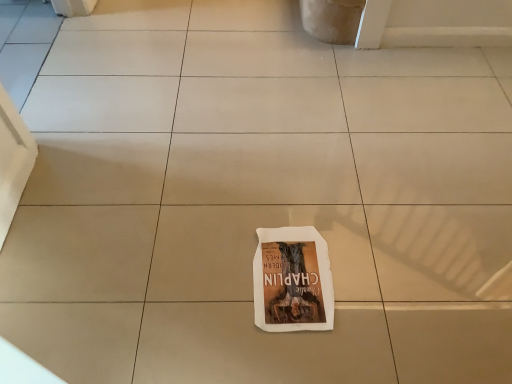
Where is `space that is in front of white paper magazine at center`? space that is in front of white paper magazine at center is located at coordinates (294, 350).